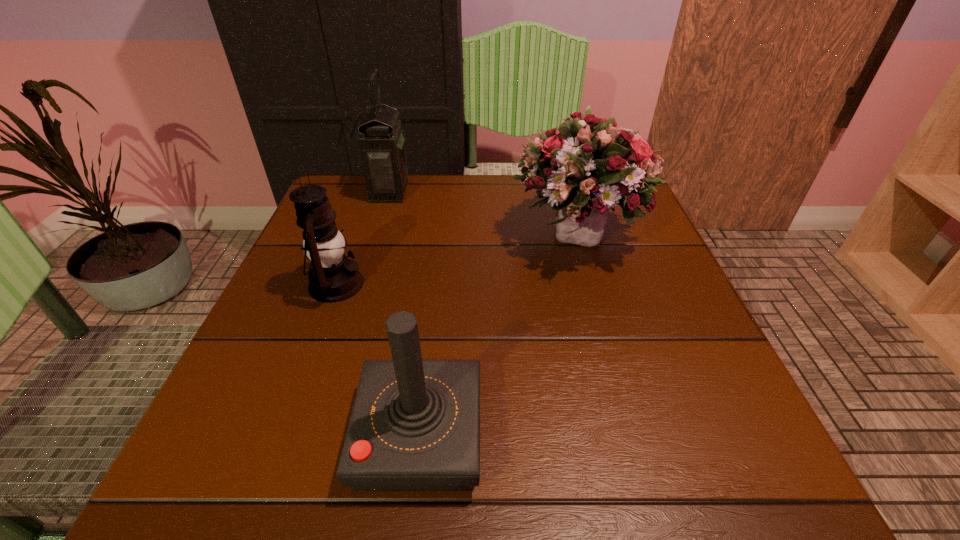
Find the location of a particular element. This screenshot has height=540, width=960. the farther lantern is located at coordinates (382, 146).

Locate an element on the screen. Image resolution: width=960 pixels, height=540 pixels. bouquet is located at coordinates (589, 167).

Where is `the nearer lantern`? the nearer lantern is located at coordinates (334, 278).

Where is `the second object from right to left`? the second object from right to left is located at coordinates (415, 424).

The image size is (960, 540). Find the location of `the nearest object`. the nearest object is located at coordinates (415, 424).

Locate an element on the screen. vacant area situated on the front-facing side of the farther lantern is located at coordinates (520, 191).

At what (x,y) coordinates should I click in order to perform the action: click on free space located 0.060m on the back of the rightmost object. Please return your answer as a coordinate pair (x, y). This screenshot has width=960, height=540. Looking at the image, I should click on (565, 189).

Find the location of a particular element. This screenshot has width=960, height=540. vacant space positioned 0.320m on the side of the shorter lantern, there is a wick adjustment knob is located at coordinates (525, 284).

Locate an element on the screen. This screenshot has width=960, height=540. vacant space located 0.360m on the rectangular base of the joystick is located at coordinates (732, 435).

At what (x,y) coordinates should I click in order to perform the action: click on lantern present at the far edge. Please return your answer as a coordinate pair (x, y). Image resolution: width=960 pixels, height=540 pixels. Looking at the image, I should click on (382, 146).